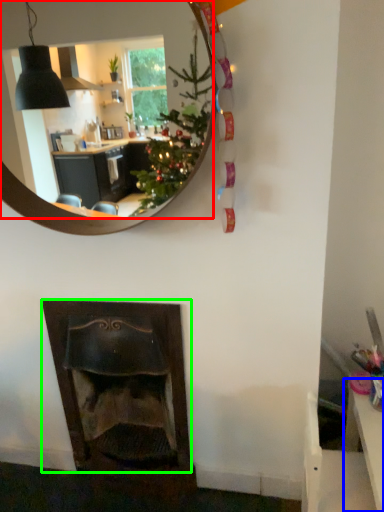
Question: Which is nearer to the mirror (highlighted by a red box)? table (highlighted by a blue box) or fireplace (highlighted by a green box).

Choices:
 (A) table
 (B) fireplace

Answer: (B)